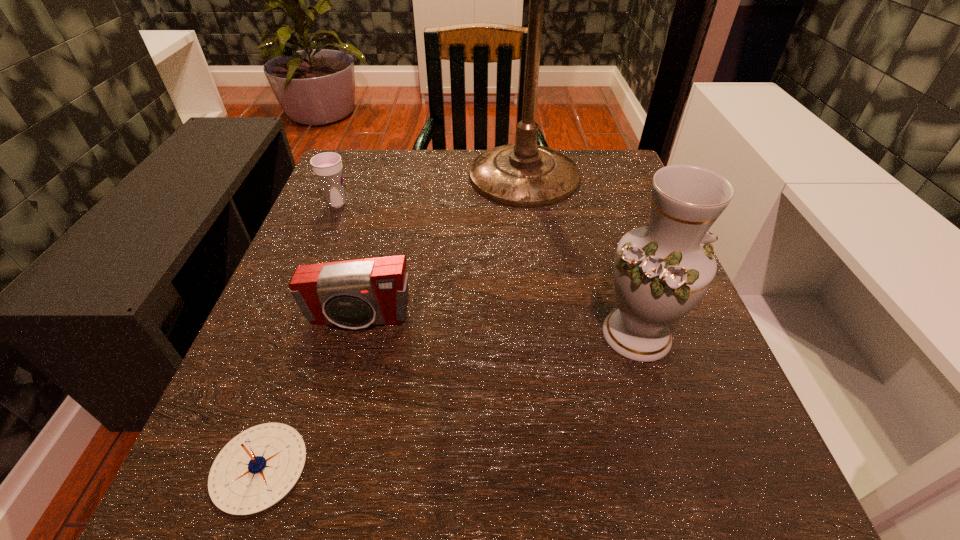
Identify the location of object present at the near left corner. (256, 469).

This screenshot has height=540, width=960. In order to click on object present at the far right corner in this screenshot , I will do `click(524, 175)`.

Find the location of `free space at the near edge of the desktop`. free space at the near edge of the desktop is located at coordinates (381, 526).

In the image, there is a desktop. At what (x,y) coordinates should I click in order to perform the action: click on vacant region at the left edge. Please return your answer as a coordinate pair (x, y). The width and height of the screenshot is (960, 540). Looking at the image, I should click on (316, 248).

Find the location of a particular element. This screenshot has height=540, width=960. vacant area at the right edge of the desktop is located at coordinates (574, 221).

I want to click on vacant space at the far left corner of the desktop, so click(326, 203).

Identify the location of blank space at the far right corner of the desktop. (610, 164).

Find the location of a particular element. free space that is in between the table lamp and the camera is located at coordinates click(x=442, y=253).

This screenshot has width=960, height=540. I want to click on vacant point located between the camera and the fourth shortest object, so click(498, 327).

This screenshot has width=960, height=540. Find the location of `free space that is in between the fourth shortest object and the camera`. free space that is in between the fourth shortest object and the camera is located at coordinates (498, 327).